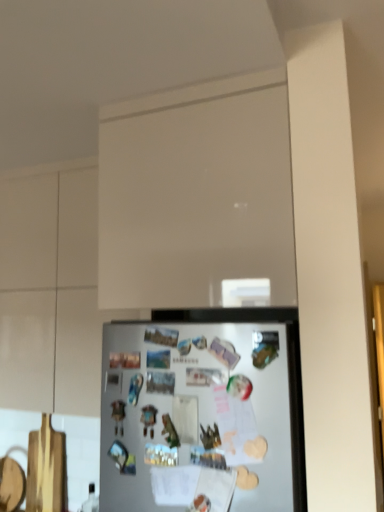
Image resolution: width=384 pixels, height=512 pixels. What do you see at coordinates (196, 194) in the screenshot?
I see `white matte glass door at upper center` at bounding box center [196, 194].

Image resolution: width=384 pixels, height=512 pixels. Describe the element at coordinates (203, 412) in the screenshot. I see `white matte refrigerator at lower center` at that location.

What are the coordinates of `white matte glass door at upper center` in the screenshot? It's located at (196, 194).

Does white matte glass door at upper center have a smaller size compared to white matte refrigerator at lower center?

No, white matte glass door at upper center is not smaller than white matte refrigerator at lower center.

From the image's perspective, is white matte glass door at upper center over white matte refrigerator at lower center?

Yes, from the image's perspective, white matte glass door at upper center is on top of white matte refrigerator at lower center.

From the picture: Is the depth of white matte glass door at upper center greater than that of white matte refrigerator at lower center?

Yes, it is behind white matte refrigerator at lower center.

Is white matte glass door at upper center outside of white matte refrigerator at lower center?

Yes.

From a real-world perspective, which object stands above the other?

white matte glass door at upper center, from a real-world perspective.

Which object is positioned more to the left, white matte glass door at upper center or white matte cabinet at upper center?

white matte cabinet at upper center is more to the left.

From the image's perspective, is white matte glass door at upper center located above white matte cabinet at upper center?

Yes.

Is there a large distance between white matte glass door at upper center and white matte cabinet at upper center?

No, white matte glass door at upper center is not far from white matte cabinet at upper center.

In the scene shown: Is white matte refrigerator at lower center a part of white matte cabinet at upper center?

No, white matte cabinet at upper center does not contain white matte refrigerator at lower center.

Is white matte cabinet at upper center taller or shorter than white matte refrigerator at lower center?

In the image, white matte cabinet at upper center appears to be taller than white matte refrigerator at lower center.

Is point (52, 275) less distant than point (180, 324)?

That is False.

Consider the image. Who is smaller, white matte cabinet at upper center or white matte refrigerator at lower center?

white matte refrigerator at lower center is smaller.

From a real-world perspective, which is physically below, white matte refrigerator at lower center or white matte cabinet at upper center?

From a 3D spatial view, white matte refrigerator at lower center is below.

Who is shorter, white matte refrigerator at lower center or white matte cabinet at upper center?

Standing shorter between the two is white matte refrigerator at lower center.

Between white matte cabinet at upper center and white matte glass door at upper center, which one has larger size?

white matte cabinet at upper center is bigger.

Is white matte cabinet at upper center facing towards white matte glass door at upper center?

No, white matte cabinet at upper center does not turn towards white matte glass door at upper center.

From the image's perspective, which one is positioned higher, white matte cabinet at upper center or white matte glass door at upper center?

From the image's view, white matte glass door at upper center is above.

Which is behind, point (53, 375) or point (170, 225)?

Point (53, 375)

Would you consider white matte refrigerator at lower center to be distant from white matte glass door at upper center?

white matte refrigerator at lower center is actually quite close to white matte glass door at upper center.

Considering the positions of objects white matte refrigerator at lower center and white matte glass door at upper center in the image provided, who is more to the right, white matte refrigerator at lower center or white matte glass door at upper center?

white matte glass door at upper center is more to the right.

Is white matte glass door at upper center completely or partially inside white matte refrigerator at lower center?

No, white matte glass door at upper center is not a part of white matte refrigerator at lower center.

The height and width of the screenshot is (512, 384). I want to click on glass door lying on the right of white matte refrigerator at lower center, so click(196, 194).

This screenshot has width=384, height=512. In order to click on glass door that appears in front of the white matte cabinet at upper center in this screenshot , I will do `click(196, 194)`.

Consider the image. Based on their spatial positions, is white matte cabinet at upper center or white matte refrigerator at lower center further from white matte glass door at upper center?

white matte cabinet at upper center lies further to white matte glass door at upper center than the other object.

Looking at the image, which one is located closer to white matte cabinet at upper center, white matte glass door at upper center or white matte refrigerator at lower center?

white matte glass door at upper center is closer to white matte cabinet at upper center.

When comparing their distances from white matte glass door at upper center, does white matte refrigerator at lower center or white matte cabinet at upper center seem further?

white matte cabinet at upper center lies further to white matte glass door at upper center than the other object.

Based on their spatial positions, is white matte refrigerator at lower center or white matte glass door at upper center closer to white matte cabinet at upper center?

The object closer to white matte cabinet at upper center is white matte glass door at upper center.

When comparing their distances from white matte refrigerator at lower center, does white matte glass door at upper center or white matte cabinet at upper center seem further?

Among the two, white matte cabinet at upper center is located further to white matte refrigerator at lower center.

Considering their positions, is white matte cabinet at upper center positioned further to white matte refrigerator at lower center than white matte glass door at upper center?

Based on the image, white matte cabinet at upper center appears to be further to white matte refrigerator at lower center.

You are a GUI agent. You are given a task and a screenshot of the screen. Output one action in this format:
    pyautogui.click(x=<x>, y=<y>)
    Task: Click on the refrigerator between white matte cabinet at upper center and white matte glass door at upper center
    The image size is (384, 512).
    Given the screenshot: What is the action you would take?
    pyautogui.click(x=203, y=412)